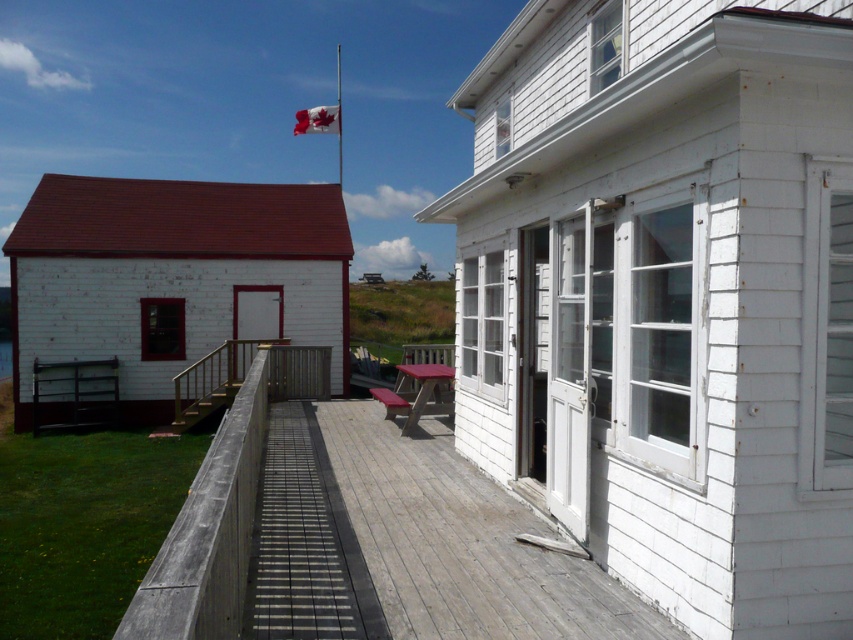
Question: Which object is closer to the camera taking this photo?

Choices:
 (A) weathered wood deck at center
 (B) red fabric flag at upper center
 (C) wooden at center
 (D) white wooden flag pole at upper center

Answer: (A)

Question: Which object is the farthest from the red fabric flag at upper center?

Choices:
 (A) weathered wood deck at center
 (B) wooden at center
 (C) white wooden flag pole at upper center

Answer: (A)

Question: Can you confirm if weathered wood deck at center is positioned to the left of wooden at center?

Choices:
 (A) no
 (B) yes

Answer: (A)

Question: Which point is closer to the camera taking this photo?

Choices:
 (A) (218, 372)
 (B) (318, 108)
 (C) (339, 145)
 (D) (300, 552)

Answer: (D)

Question: Is red fabric flag at upper center smaller than white wooden flag pole at upper center?

Choices:
 (A) yes
 (B) no

Answer: (B)

Question: Does wooden at center appear on the left side of red fabric flag at upper center?

Choices:
 (A) yes
 (B) no

Answer: (B)